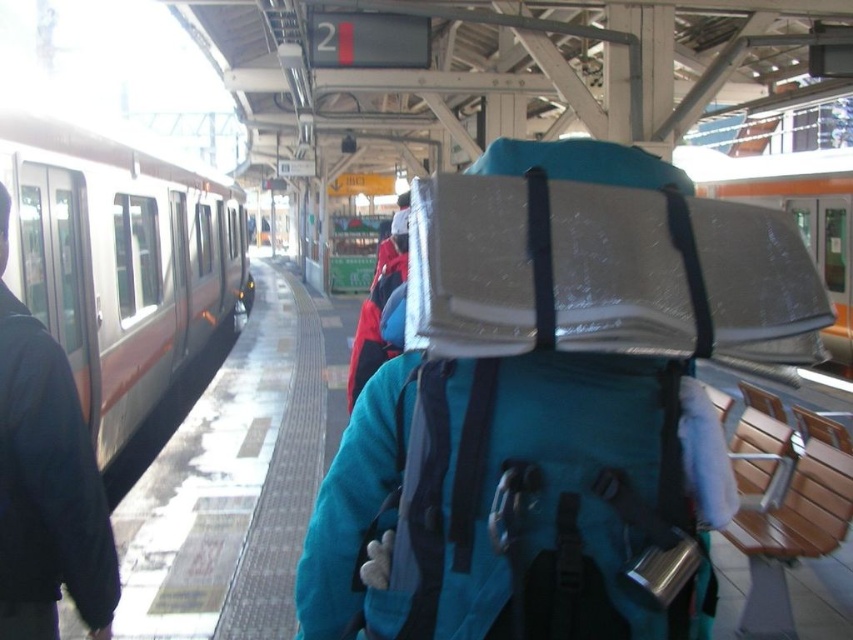
Question: Can you confirm if silver metallic train at left is positioned below metallic silver train at right?

Choices:
 (A) no
 (B) yes

Answer: (B)

Question: Which of the following is the farthest from the observer?

Choices:
 (A) metallic silver train at right
 (B) silver metallic train at left

Answer: (B)

Question: Is silver metallic train at left below metallic silver train at right?

Choices:
 (A) yes
 (B) no

Answer: (A)

Question: Among these points, which one is nearest to the camera?

Choices:
 (A) (814, 257)
 (B) (80, 602)
 (C) (83, 291)

Answer: (B)

Question: Among these points, which one is farthest from the camera?

Choices:
 (A) (35, 237)
 (B) (108, 630)

Answer: (A)

Question: Does silver metallic train at left appear under dark blue fabric jacket at left?

Choices:
 (A) yes
 (B) no

Answer: (B)